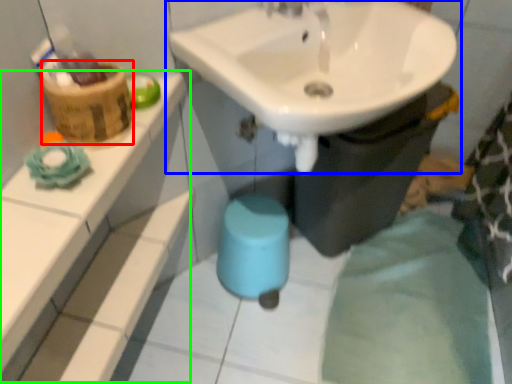
Question: Considering the real-world distances, which object is closest to basket (highlighted by a red box)? sink (highlighted by a blue box) or balustrade (highlighted by a green box).

Choices:
 (A) sink
 (B) balustrade

Answer: (B)